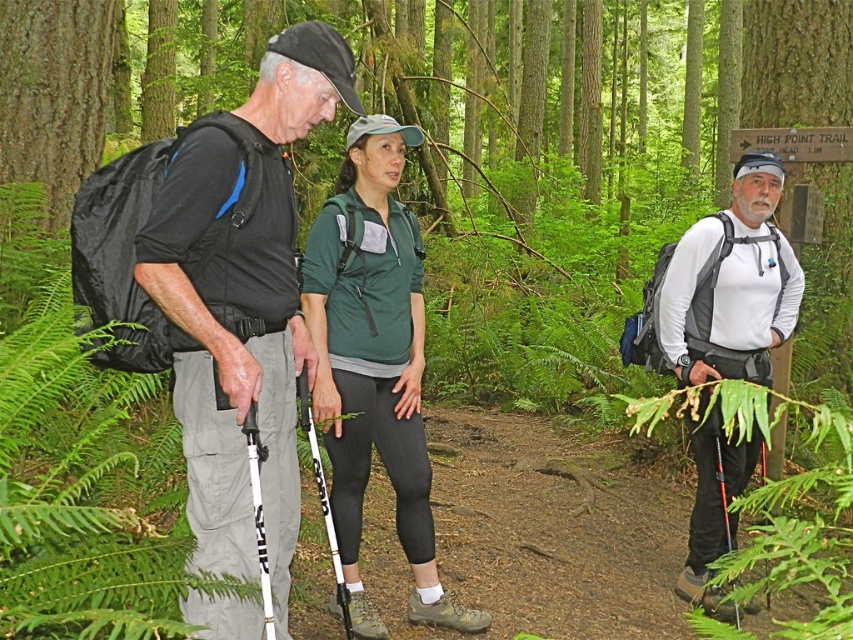
You are a hiker trying to identify clothing colors in the forest. You see the green fabric shirt at center and the white matte shirt at center. Which one is higher up on the person?

The green fabric shirt at center is located above the white matte shirt at center.

You are a hiker trying to navigate through the forest. You see two points marked on your map at coordinates point (193, 300) and point (350, 296). Which point is closer to your current position if you are standing at the camera position?

Point (193, 300) is closer to the camera than point (350, 296), so the point closer to your current position is point (193, 300).